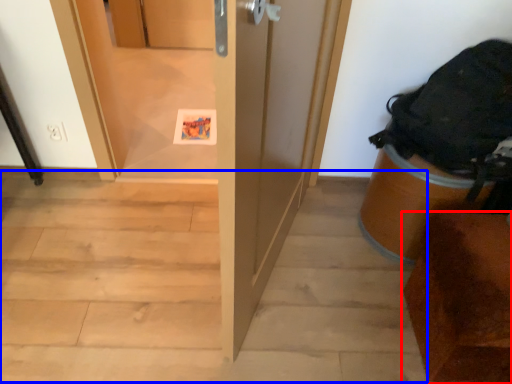
Question: Which object appears closest to the camera in this image, furniture (highlighted by a red box) or stairwell (highlighted by a blue box)?

Choices:
 (A) furniture
 (B) stairwell

Answer: (A)